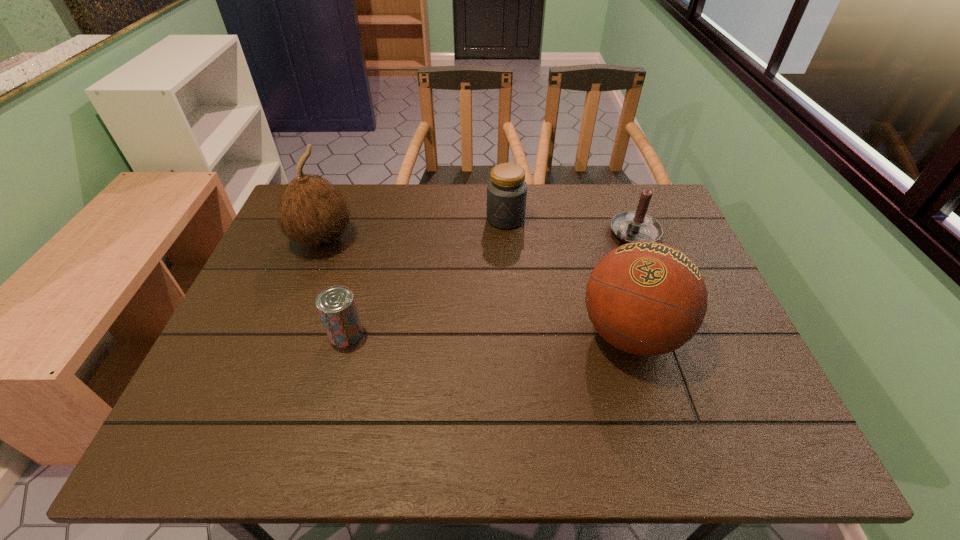
The width and height of the screenshot is (960, 540). What are the coordinates of `the fourth object from right to left` in the screenshot? It's located at (336, 305).

This screenshot has height=540, width=960. Find the location of `the shortest object`. the shortest object is located at coordinates (336, 305).

Locate an element on the screen. This screenshot has height=540, width=960. basketball is located at coordinates (646, 298).

You are a GUI agent. You are given a task and a screenshot of the screen. Output one action in this format:
    pyautogui.click(x=<x>, y=<y>)
    Task: Click on the leftmost object
    This screenshot has width=960, height=540.
    Given the screenshot: What is the action you would take?
    pyautogui.click(x=311, y=210)

At what (x,y) coordinates should I click in order to perform the action: click on jar. Please return your answer as a coordinate pair (x, y). Looking at the image, I should click on (506, 190).

Where is `candle`? This screenshot has width=960, height=540. candle is located at coordinates (x=634, y=226).

The image size is (960, 540). I want to click on vacant space located 0.140m on the front of the second object from left to right, so click(x=327, y=404).

Where is `vacant space located on the left of the basketball`? This screenshot has width=960, height=540. vacant space located on the left of the basketball is located at coordinates (515, 334).

Image resolution: width=960 pixels, height=540 pixels. In order to click on vacant space positioned 0.250m on the surface of the coconut in this screenshot , I will do `click(415, 287)`.

This screenshot has width=960, height=540. Identify the location of free space located 0.290m on the surface of the coconut. (427, 293).